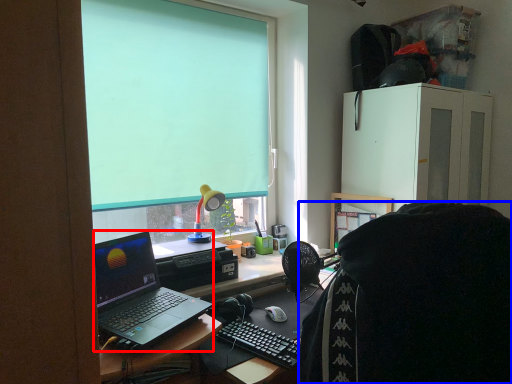
Question: Which of the following is the closest to the observer, laptop (highlighted by a red box) or person (highlighted by a blue box)?

Choices:
 (A) laptop
 (B) person

Answer: (B)